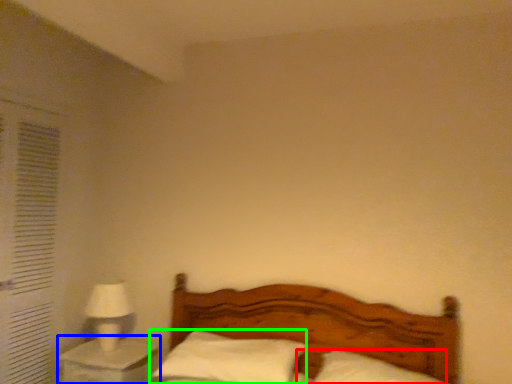
Question: Estimate the real-world distances between objects in this image. Which object is farther from pillow (highlighted by a red box), nightstand (highlighted by a blue box) or pillow (highlighted by a green box)?

Choices:
 (A) nightstand
 (B) pillow

Answer: (A)